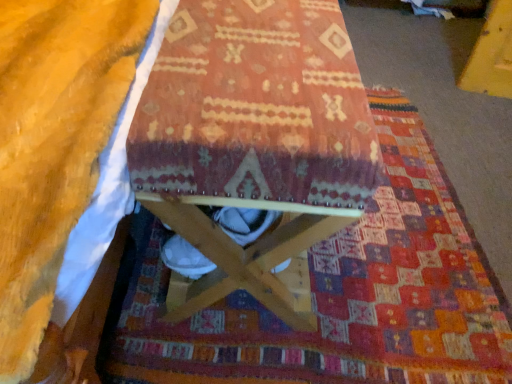
Question: Is textured woolen mat at center directly adjacent to soft yellow blanket at lower left?

Choices:
 (A) yes
 (B) no

Answer: (B)

Question: Considering the relative positions of textured woolen mat at center and soft yellow blanket at lower left in the image provided, is textured woolen mat at center to the left of soft yellow blanket at lower left from the viewer's perspective?

Choices:
 (A) no
 (B) yes

Answer: (A)

Question: From a real-world perspective, is textured woolen mat at center located higher than soft yellow blanket at lower left?

Choices:
 (A) no
 (B) yes

Answer: (A)

Question: From the image's perspective, is textured woolen mat at center beneath soft yellow blanket at lower left?

Choices:
 (A) yes
 (B) no

Answer: (A)

Question: Does textured woolen mat at center turn towards soft yellow blanket at lower left?

Choices:
 (A) yes
 (B) no

Answer: (B)

Question: In the image, is wooden stool at center on the left side or the right side of soft yellow blanket at lower left?

Choices:
 (A) left
 (B) right

Answer: (B)

Question: Considering the positions of wooden stool at center and soft yellow blanket at lower left in the image, is wooden stool at center taller or shorter than soft yellow blanket at lower left?

Choices:
 (A) tall
 (B) short

Answer: (A)

Question: Looking at their shapes, would you say wooden stool at center is wider or thinner than soft yellow blanket at lower left?

Choices:
 (A) thin
 (B) wide

Answer: (A)

Question: From the image's perspective, relative to soft yellow blanket at lower left, is wooden stool at center above or below?

Choices:
 (A) below
 (B) above

Answer: (A)

Question: Is point (105, 81) positioned closer to the camera than point (411, 163)?

Choices:
 (A) farther
 (B) closer

Answer: (B)

Question: From a real-world perspective, relative to textured woolen mat at center, is soft yellow blanket at lower left vertically above or below?

Choices:
 (A) below
 (B) above

Answer: (B)

Question: Based on their sizes in the image, would you say soft yellow blanket at lower left is bigger or smaller than textured woolen mat at center?

Choices:
 (A) small
 (B) big

Answer: (A)

Question: From their relative heights in the image, would you say soft yellow blanket at lower left is taller or shorter than textured woolen mat at center?

Choices:
 (A) short
 (B) tall

Answer: (B)

Question: Considering their positions, is soft yellow blanket at lower left located in front of or behind wooden stool at center?

Choices:
 (A) front
 (B) behind

Answer: (A)

Question: From a real-world perspective, relative to wooden stool at center, is soft yellow blanket at lower left vertically above or below?

Choices:
 (A) above
 (B) below

Answer: (A)